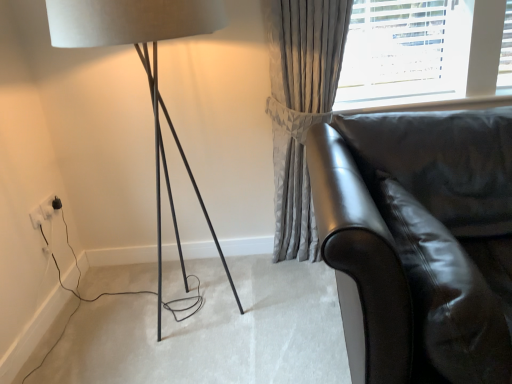
Locate an element on the screen. The width and height of the screenshot is (512, 384). vacant space behind matte black lamp at left is located at coordinates (x=202, y=270).